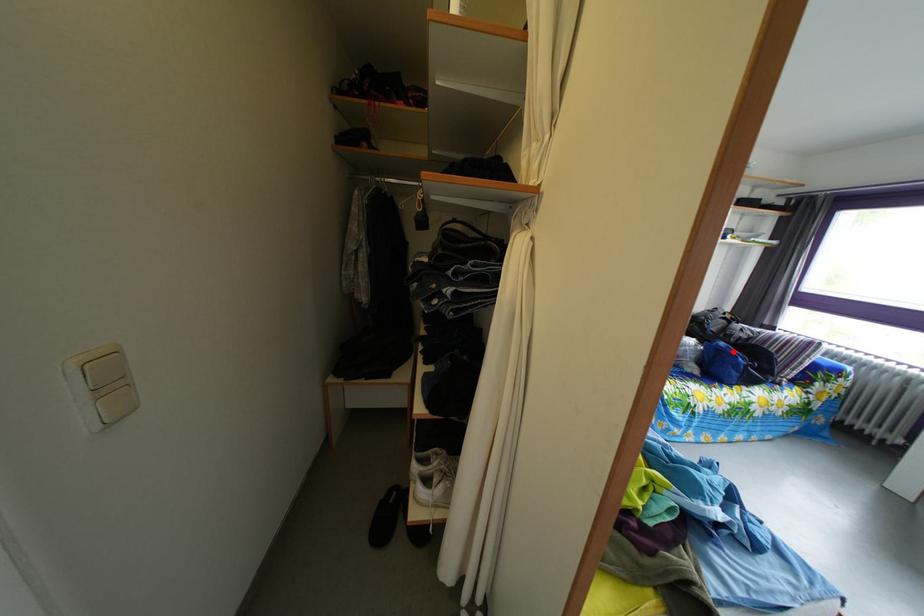
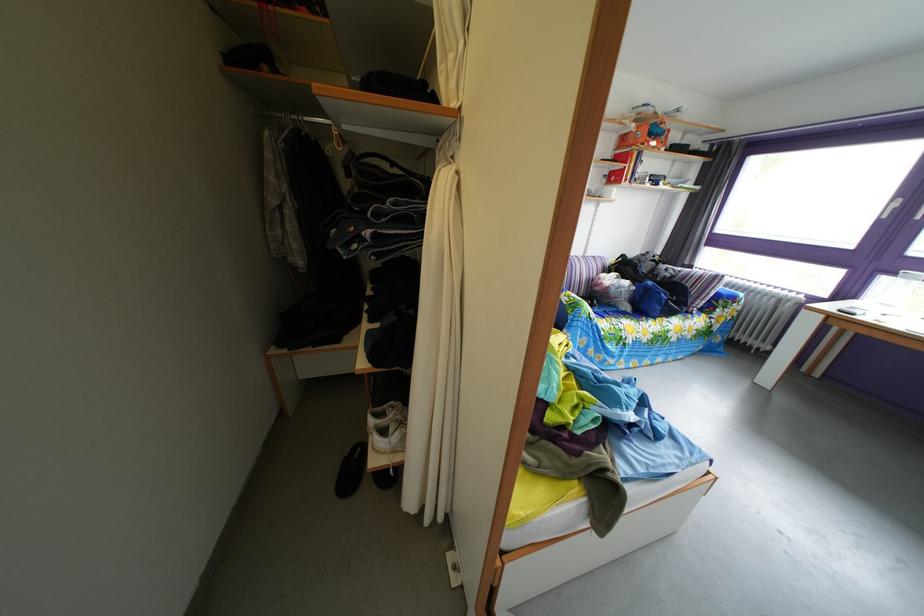
Question: I am providing you with two images of the same scene from different viewpoints. A red point is shown in image1. For the corresponding object point in image2, is it positioned nearer or farther from the camera?

Choices:
 (A) Nearer
 (B) Farther

Answer: (A)